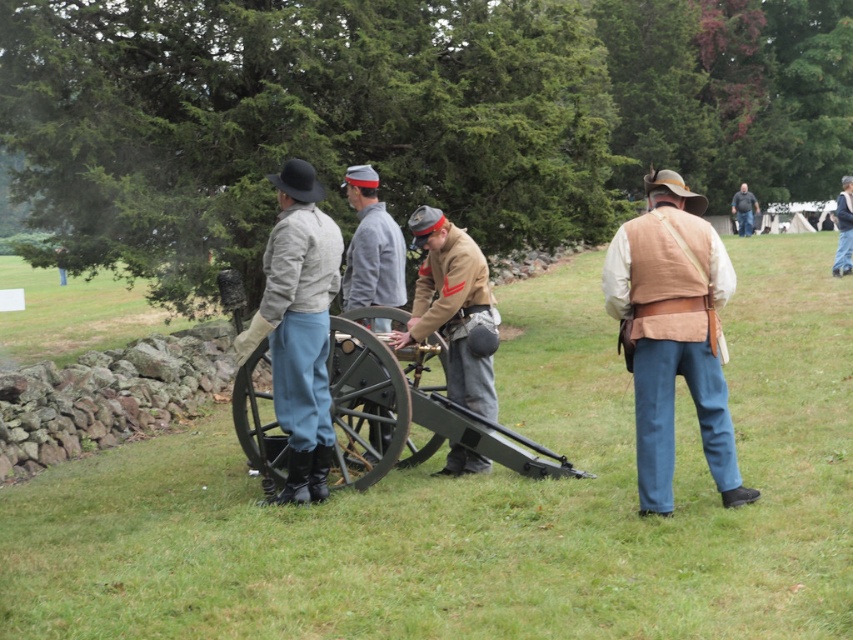
Does green matte cannon at center have a larger size compared to brown leather jacket at center?

Actually, green matte cannon at center might be smaller than brown leather jacket at center.

Is point (334, 460) closer to camera compared to point (846, 253)?

Yes, it is in front of point (846, 253).

Who is more distant from viewer, (x=525, y=476) or (x=850, y=209)?

Positioned behind is point (x=850, y=209).

Identify the location of green matte cannon at center. This screenshot has height=640, width=853. (407, 410).

Is green matte cannon at center thinner than light beige fabric uniform at center?

No.

Can you confirm if green matte cannon at center is shorter than light beige fabric uniform at center?

Yes.

Is point (334, 422) positioned behind point (325, 250)?

Yes, point (334, 422) is behind point (325, 250).

At what (x,y) coordinates should I click in order to perform the action: click on green matte cannon at center. Please return your answer as a coordinate pair (x, y). Looking at the image, I should click on (407, 410).

Who is more forward, (486, 397) or (838, 216)?

Point (486, 397) is more forward.

Is tan leather jacket at center closer to the viewer compared to brown leather jacket at center?

Yes, it is in front of brown leather jacket at center.

Who is more distant from viewer, (453, 378) or (845, 176)?

Positioned behind is point (845, 176).

Locate an element on the screen. tan leather jacket at center is located at coordinates (454, 308).